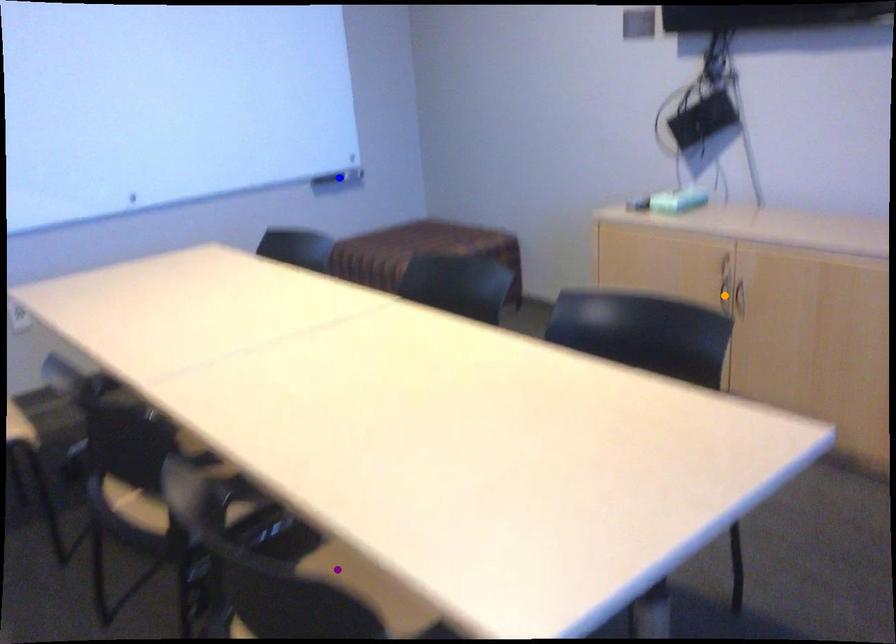
Order these from nearest to farthest:
blue point
orange point
purple point

blue point, orange point, purple point